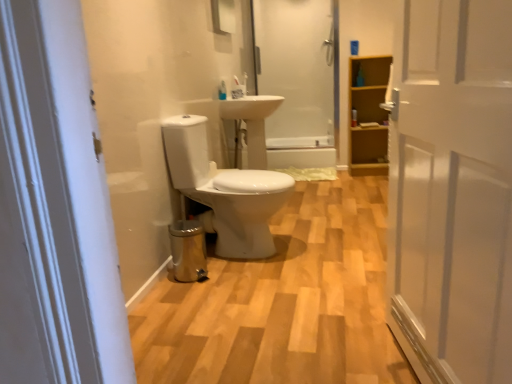
Question: Is white glossy toilet at center thinner than light brown wood cabinet at right?

Choices:
 (A) yes
 (B) no

Answer: (B)

Question: Does white glossy toilet at center appear on the right side of light brown wood cabinet at right?

Choices:
 (A) no
 (B) yes

Answer: (A)

Question: From the image's perspective, is white glossy toilet at center above light brown wood cabinet at right?

Choices:
 (A) yes
 (B) no

Answer: (B)

Question: Is white glossy toilet at center closer to the viewer compared to light brown wood cabinet at right?

Choices:
 (A) no
 (B) yes

Answer: (B)

Question: From the image's perspective, is white glossy toilet at center under light brown wood cabinet at right?

Choices:
 (A) no
 (B) yes

Answer: (B)

Question: Is translucent plastic toothbrush at center, which is the second toiletry from back to front, taller or shorter than translucent glass shower door at upper center?

Choices:
 (A) short
 (B) tall

Answer: (A)

Question: Is point (224, 82) positioned closer to the camera than point (327, 117)?

Choices:
 (A) farther
 (B) closer

Answer: (B)

Question: Considering their positions, is translucent plastic toothbrush at center, the 2th toiletry positioned from the right, located in front of or behind translucent glass shower door at upper center?

Choices:
 (A) front
 (B) behind

Answer: (A)

Question: Choose the correct answer: Is translucent plastic toothbrush at center, the 2th toiletry positioned from the right, inside translucent glass shower door at upper center or outside it?

Choices:
 (A) outside
 (B) inside

Answer: (A)

Question: Do you think translucent glass shower door at upper center is within white glossy toilet at center, or outside of it?

Choices:
 (A) outside
 (B) inside

Answer: (A)

Question: From the image's perspective, relative to white glossy toilet at center, is translucent glass shower door at upper center above or below?

Choices:
 (A) above
 (B) below

Answer: (A)

Question: Considering the positions of translucent glass shower door at upper center and white glossy toilet at center in the image, is translucent glass shower door at upper center taller or shorter than white glossy toilet at center?

Choices:
 (A) short
 (B) tall

Answer: (B)

Question: Is translucent glass shower door at upper center in front of or behind white glossy toilet at center in the image?

Choices:
 (A) front
 (B) behind

Answer: (B)

Question: Based on their sizes in the image, would you say glossy glass mirror at upper center is bigger or smaller than translucent plastic toothbrush at center, the 2th toiletry positioned from the right?

Choices:
 (A) small
 (B) big

Answer: (B)

Question: In the image, is glossy glass mirror at upper center positioned in front of or behind translucent plastic toothbrush at center, which is the second toiletry from back to front?

Choices:
 (A) front
 (B) behind

Answer: (A)